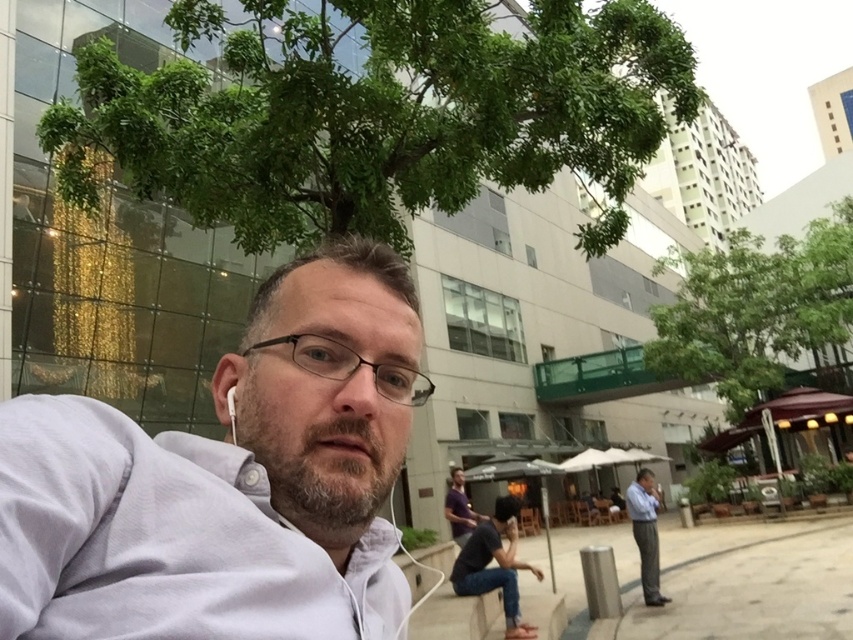
Question: Which of the following is the farthest from the observer?

Choices:
 (A) green leafy tree at upper right
 (B) light blue shirt at right
 (C) gray cotton shirt at center
 (D) green leafy tree at upper center

Answer: (A)

Question: Can you confirm if black plastic glasses at center is positioned above dark purple shirt at center?

Choices:
 (A) yes
 (B) no

Answer: (A)

Question: Which object is positioned farthest from the black plastic glasses at center?

Choices:
 (A) gray cotton shirt at center
 (B) green leafy tree at upper right

Answer: (B)

Question: Is green leafy tree at upper right behind dark purple shirt at center?

Choices:
 (A) yes
 (B) no

Answer: (A)

Question: Considering the real-world distances, which object is farthest from the light blue shirt at right?

Choices:
 (A) green leafy tree at upper right
 (B) dark purple shirt at center
 (C) gray cotton shirt at center
 (D) green leafy tree at upper center

Answer: (C)

Question: Can you confirm if green leafy tree at upper center is thinner than light blue shirt at right?

Choices:
 (A) yes
 (B) no

Answer: (A)